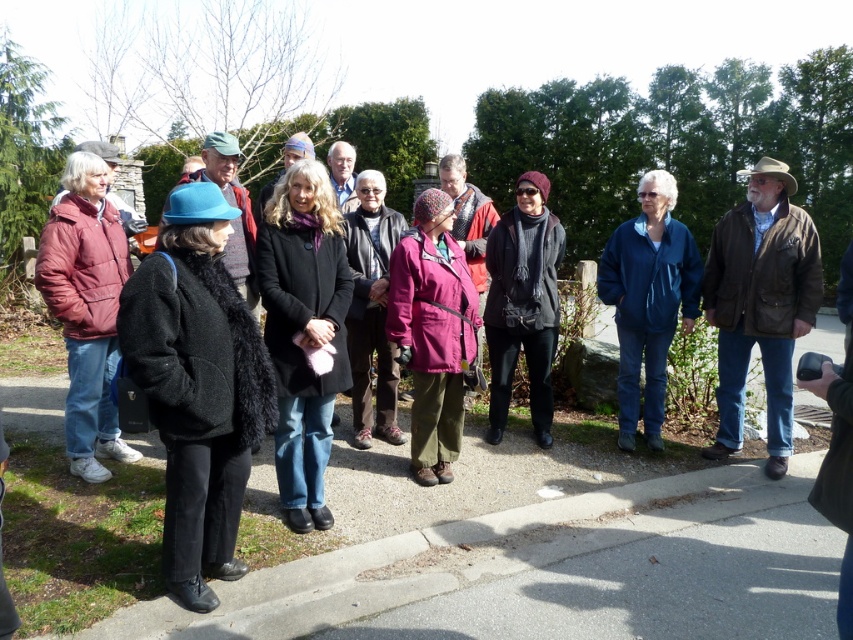
Is matte black coat at left below blue fleece jacket at center?

Yes.

Who is more distant from viewer, (256,417) or (688,278)?

The point (688,278) is behind.

Is point (213, 216) positioned before point (654, 397)?

Yes, point (213, 216) is closer to viewer.

Locate an element on the screen. This screenshot has height=640, width=853. matte black coat at left is located at coordinates (196, 387).

Who is positioned more to the left, black wool coat at center or brown leather jacket at right?

From the viewer's perspective, black wool coat at center appears more on the left side.

Find the location of a particular element. black wool coat at center is located at coordinates (303, 332).

In order to click on black wool coat at center in this screenshot , I will do `click(303, 332)`.

Find the location of a particular element. The width and height of the screenshot is (853, 640). black wool coat at center is located at coordinates (303, 332).

The width and height of the screenshot is (853, 640). I want to click on blue fleece jacket at center, so click(x=648, y=300).

Which is behind, point (689, 296) or point (364, 237)?

Positioned behind is point (689, 296).

Who is more distant from viewer, (659, 196) or (392, 403)?

The point (392, 403) is behind.

Locate an element on the screen. blue fleece jacket at center is located at coordinates (648, 300).